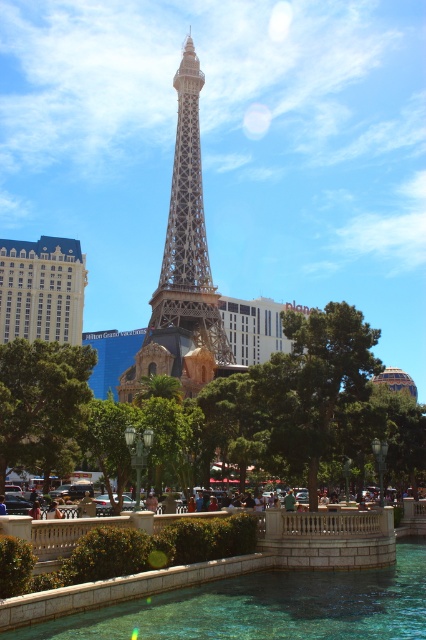
Question: Can you confirm if clear glass pool at center is positioned below metallic lattice tower at center?

Choices:
 (A) yes
 (B) no

Answer: (A)

Question: Which object is the closest to the green leafy tree at center?

Choices:
 (A) matte blue building at left
 (B) clear glass pool at center
 (C) metallic lattice tower at center

Answer: (C)

Question: Can you confirm if clear glass pool at center is positioned below metallic lattice tower at center?

Choices:
 (A) yes
 (B) no

Answer: (A)

Question: Which point appears closest to the camera in this image?

Choices:
 (A) (66, 403)
 (B) (181, 387)
 (C) (58, 634)

Answer: (C)

Question: Is clear glass pool at center smaller than green leafy tree at center?

Choices:
 (A) yes
 (B) no

Answer: (B)

Question: Among these points, which one is farthest from the camera?

Choices:
 (A) (282, 595)
 (B) (198, 115)
 (C) (54, 237)
 (D) (5, 435)

Answer: (C)